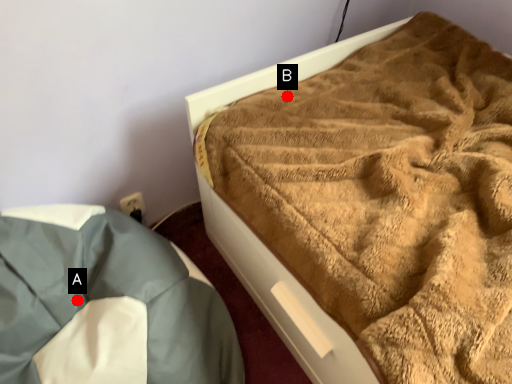
Question: Two points are circled on the image, labeled by A and B beside each circle. Among these points, which one is nearest to the camera?

Choices:
 (A) A is closer
 (B) B is closer

Answer: (A)